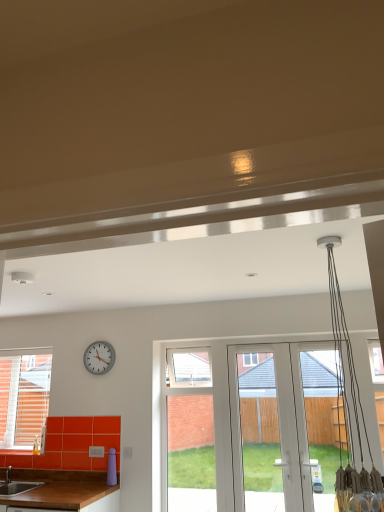
Question: Is brown wooden countertop at lower left not near matte brown sink at lower left?

Choices:
 (A) yes
 (B) no

Answer: (B)

Question: From a real-world perspective, does brown wooden countertop at lower left stand above matte brown sink at lower left?

Choices:
 (A) no
 (B) yes

Answer: (A)

Question: Can you confirm if brown wooden countertop at lower left is smaller than matte brown sink at lower left?

Choices:
 (A) yes
 (B) no

Answer: (B)

Question: From a real-world perspective, is brown wooden countertop at lower left beneath matte brown sink at lower left?

Choices:
 (A) no
 (B) yes

Answer: (B)

Question: Is matte brown sink at lower left surrounded by brown wooden countertop at lower left?

Choices:
 (A) yes
 (B) no

Answer: (B)

Question: Can you confirm if brown wooden countertop at lower left is positioned to the right of matte brown sink at lower left?

Choices:
 (A) yes
 (B) no

Answer: (A)

Question: Is white glossy screen door at center positioned in front of brown wooden countertop at lower left?

Choices:
 (A) no
 (B) yes

Answer: (A)

Question: Can you confirm if white glossy screen door at center is taller than brown wooden countertop at lower left?

Choices:
 (A) no
 (B) yes

Answer: (B)

Question: Is white glossy screen door at center smaller than brown wooden countertop at lower left?

Choices:
 (A) yes
 (B) no

Answer: (A)

Question: Considering the relative positions of white glossy screen door at center and brown wooden countertop at lower left in the image provided, is white glossy screen door at center to the left of brown wooden countertop at lower left from the viewer's perspective?

Choices:
 (A) yes
 (B) no

Answer: (B)

Question: Does white glossy screen door at center have a lesser height compared to brown wooden countertop at lower left?

Choices:
 (A) no
 (B) yes

Answer: (A)

Question: Is white glossy screen door at center in contact with brown wooden countertop at lower left?

Choices:
 (A) yes
 (B) no

Answer: (B)

Question: From the image's perspective, is white glossy screen door at center above matte brown sink at lower left?

Choices:
 (A) no
 (B) yes

Answer: (B)